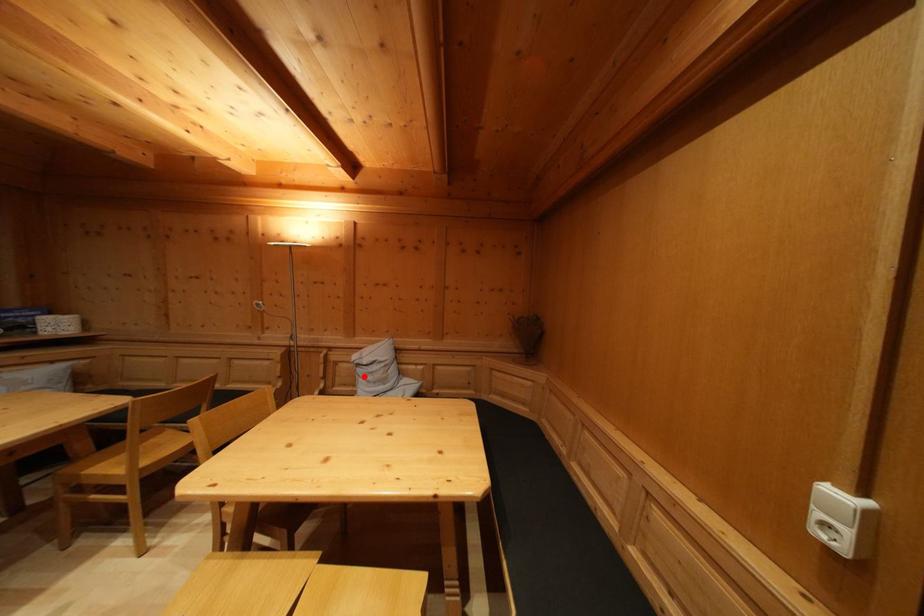
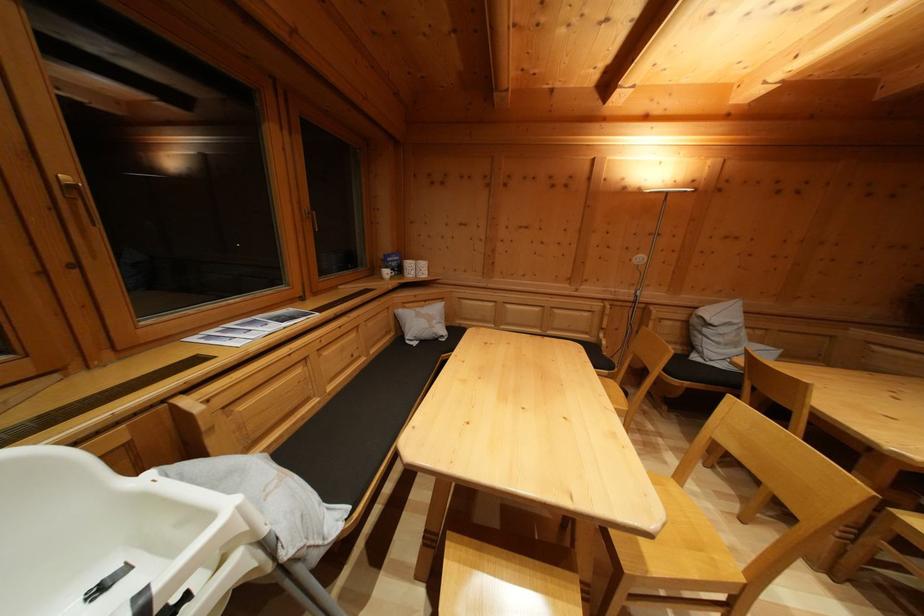
Question: I am providing you with two images of the same scene from different viewpoints. Image1 has a red point marked. In image2, the corresponding 3D location appears at what relative position? Reply with the corresponding letter.

Choices:
 (A) Closer
 (B) Farther

Answer: (A)